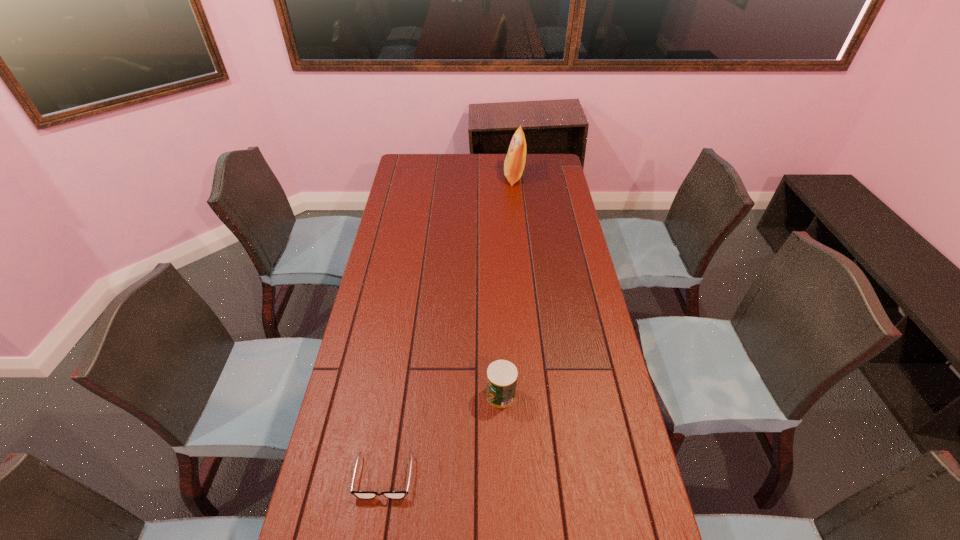
Locate an element on the screen. This screenshot has width=960, height=540. the tallest object is located at coordinates (514, 163).

Locate an element on the screen. This screenshot has width=960, height=540. the farthest object is located at coordinates (514, 163).

I want to click on can, so click(501, 375).

This screenshot has width=960, height=540. In order to click on the second tallest object in this screenshot , I will do `click(501, 375)`.

Locate an element on the screen. spectacles is located at coordinates (359, 494).

Identify the location of the shortest object. (359, 494).

Locate an element on the screen. The image size is (960, 540). blank area located on the front-facing side of the farthest object is located at coordinates pos(483,178).

Locate an element on the screen. vacant space located 0.170m on the front-facing side of the farthest object is located at coordinates (468, 178).

You are a GUI agent. You are given a task and a screenshot of the screen. Output one action in this format:
    pyautogui.click(x=<x>, y=<y>)
    Task: Click on the blank space located on the front-facing side of the farthest object
    The height and width of the screenshot is (540, 960).
    Given the screenshot: What is the action you would take?
    pyautogui.click(x=447, y=178)

Where is `free space located 0.210m on the front of the second tallest object`? The height and width of the screenshot is (540, 960). free space located 0.210m on the front of the second tallest object is located at coordinates (504, 485).